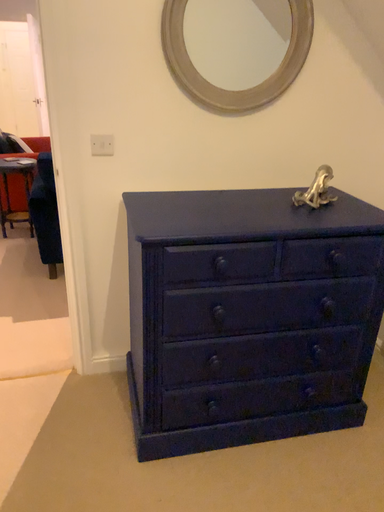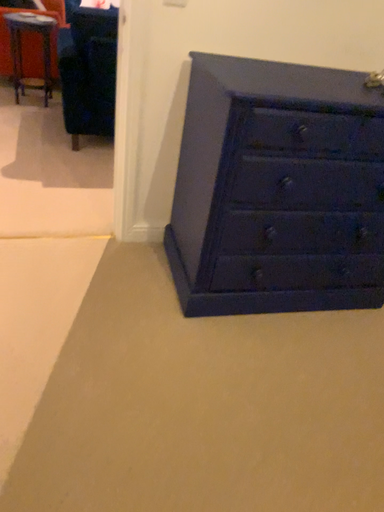
Question: Which way did the camera rotate in the video?

Choices:
 (A) rotated downward
 (B) rotated upward

Answer: (A)